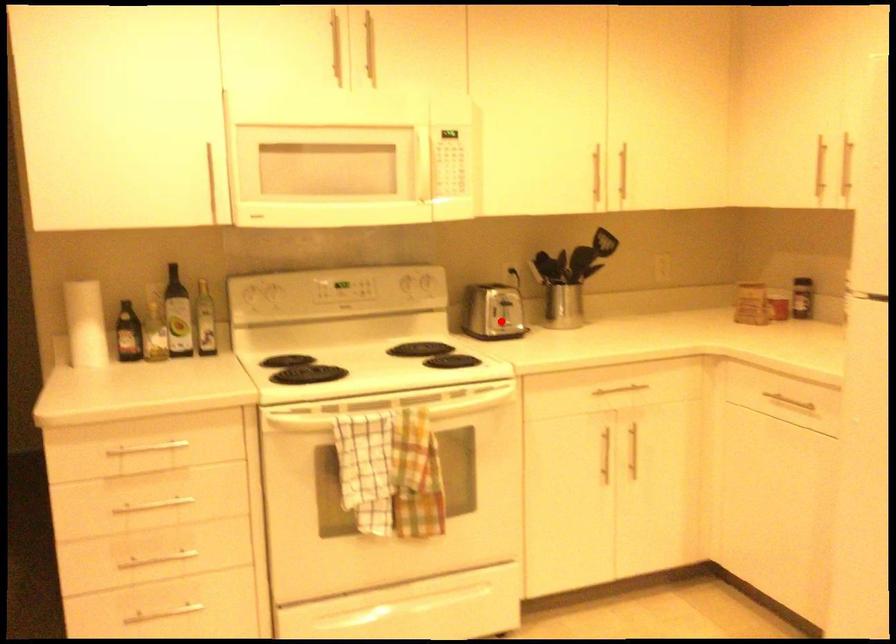
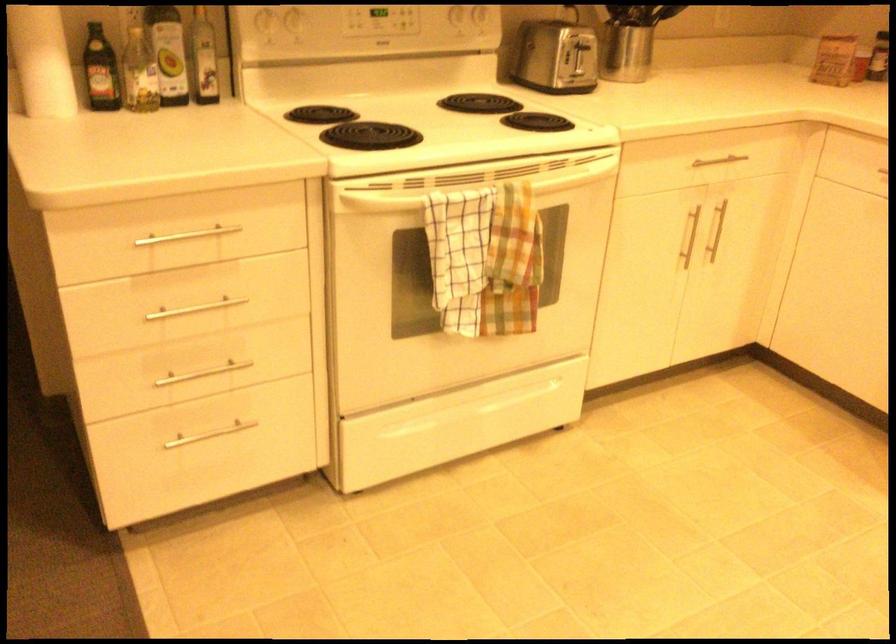
Question: I am providing you with two images of the same scene from different viewpoints. In image1, a red point is highlighted. Considering the same 3D point in image2, which of the following is correct?

Choices:
 (A) It is closer
 (B) It is farther

Answer: (A)